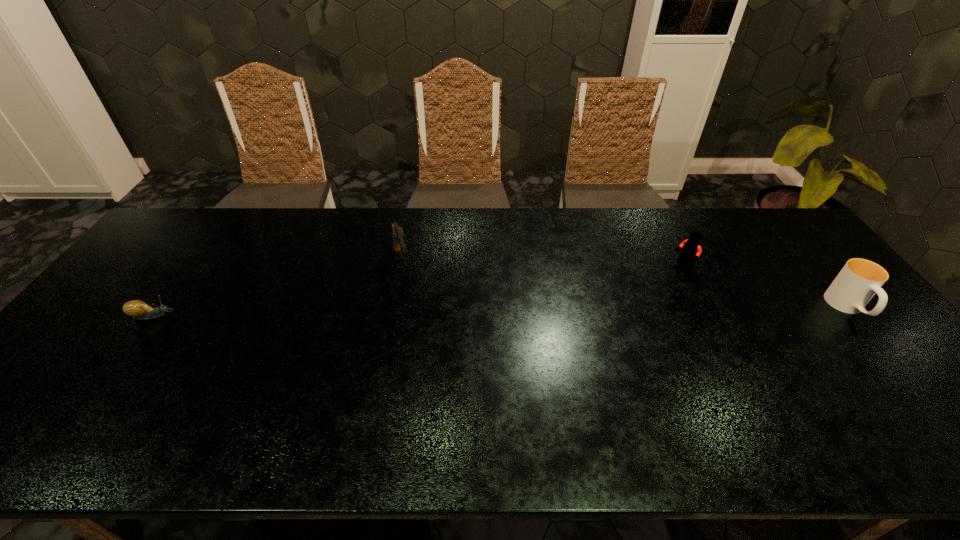
Image resolution: width=960 pixels, height=540 pixels. Find the location of `free spot between the rightmost object and the Lego`. free spot between the rightmost object and the Lego is located at coordinates (766, 287).

Identify which object is the closest to the rightmost object. Please provide its 2D coordinates. Your answer should be formatted as a tuple, i.e. [(x, y)], where the tuple contains the x and y coordinates of a point satisfying the conditions above.

[(691, 249)]

I want to click on object that is the closest to the shortest object, so click(x=399, y=237).

Locate an element on the screen. vacant space that satisfies the following two spatial constraints: 1. on the front side of the Lego; 2. on the right side of the gun is located at coordinates (402, 265).